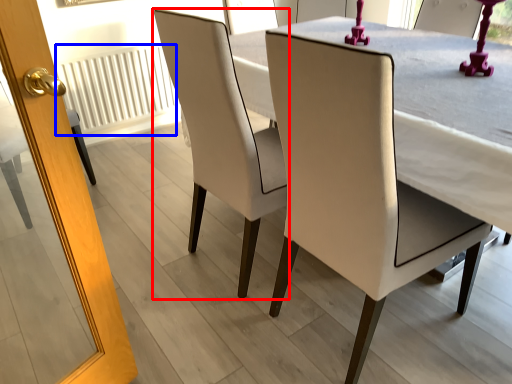
Question: Which object is closer to the camera taking this photo, chair (highlighted by a red box) or radiator (highlighted by a blue box)?

Choices:
 (A) chair
 (B) radiator

Answer: (A)